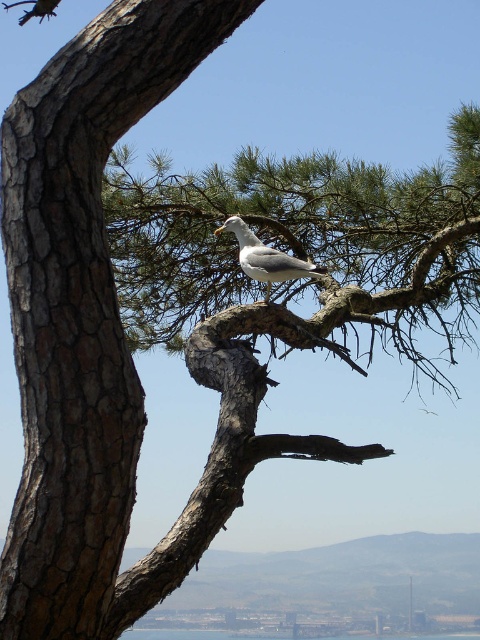
What is located at the point with coordinates [266,257] in the image?

At point [266,257] lies the white matte bird at upper center.

You are standing at the base of the tree and want to take a photo of the white matte bird at upper center. The camera you are using has a maximum focus range of 12 meters. Will the camera be able to focus on the bird?

The white matte bird at upper center and camera are 11.85 meters apart, so the camera can focus on the bird since the distance is within the maximum focus range of 12 meters.

You are standing in the scene and want to observe the white matte bird at upper center and the transparent blue water at center. Which object is located higher in the image?

The white matte bird at upper center is located higher than the transparent blue water at center.